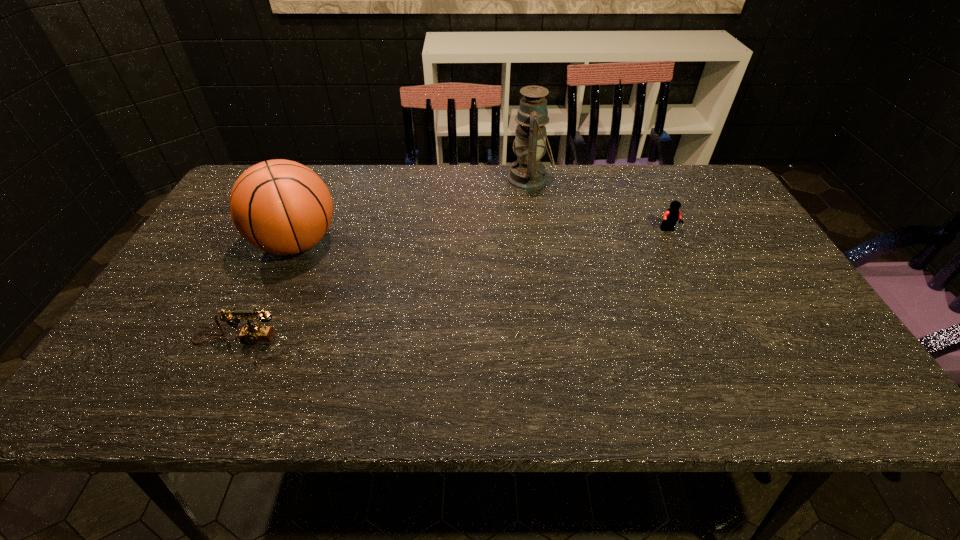
Locate an element on the screen. This screenshot has height=540, width=960. telephone present at the left edge is located at coordinates (251, 333).

Find the location of a particular element. free space at the far edge of the desktop is located at coordinates (497, 165).

Locate an element on the screen. This screenshot has height=540, width=960. free space at the left edge of the desktop is located at coordinates (200, 239).

I want to click on vacant space at the near left corner, so click(x=148, y=397).

At what (x,y) coordinates should I click in order to perform the action: click on vacant space at the far right corner. Please return your answer as a coordinate pair (x, y). Looking at the image, I should click on (708, 172).

You are a GUI agent. You are given a task and a screenshot of the screen. Output one action in this format:
    pyautogui.click(x=<x>, y=<y>)
    Task: Click on the empty location between the telephone and the basketball
    
    Given the screenshot: What is the action you would take?
    pyautogui.click(x=267, y=291)

Locate an element on the screen. Image resolution: width=960 pixels, height=540 pixels. vacant area that lies between the basketball and the nearest object is located at coordinates (267, 291).

Identify the location of free space between the third shortest object and the farthest object. (413, 212).

This screenshot has width=960, height=540. I want to click on empty location between the rightmost object and the telephone, so click(452, 285).

The image size is (960, 540). What are the coordinates of `vacant point located between the farthest object and the telephone` in the screenshot? It's located at (383, 259).